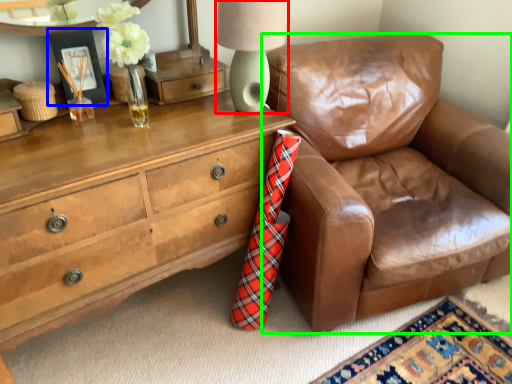
Question: Estimate the real-world distances between objects in this image. Which object is farther from table lamp (highlighted by a red box), picture frame (highlighted by a blue box) or chair (highlighted by a green box)?

Choices:
 (A) picture frame
 (B) chair

Answer: (B)